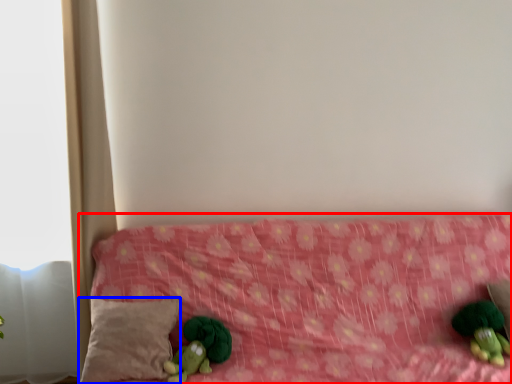
Question: Which object is closer to the camera taking this photo, furniture (highlighted by a red box) or pillow (highlighted by a blue box)?

Choices:
 (A) furniture
 (B) pillow

Answer: (A)